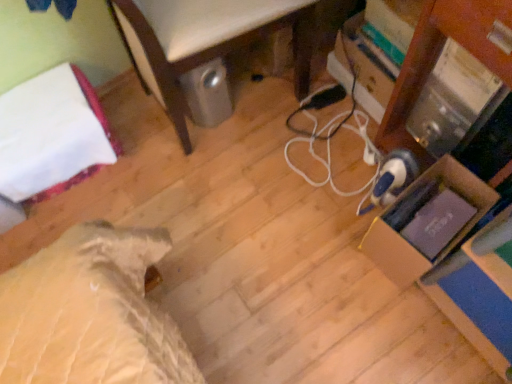
This screenshot has height=384, width=512. I want to click on vacant space underneath white cord at center (from a real-world perspective), so click(320, 158).